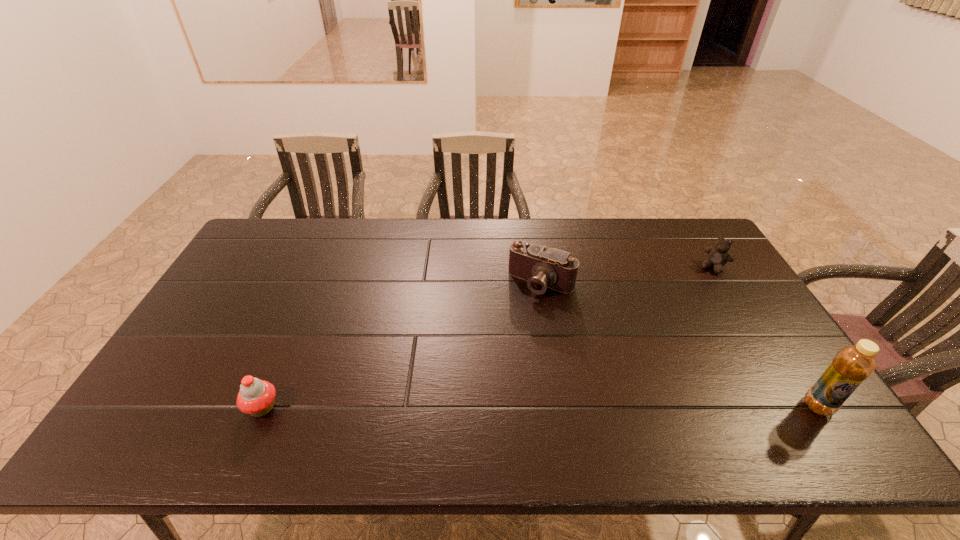
At what (x,y) coordinates should I click in order to perform the action: click on vacant space on the desktop that is between the leftmost object and the bottle and is positioned on the face of the teddy bear. Please return your answer as a coordinate pair (x, y). The image size is (960, 540). Looking at the image, I should click on (617, 407).

At what (x,y) coordinates should I click in order to perform the action: click on free space on the desktop that is between the cupcake and the bottle and is positioned on the front-facing side of the third object from right to left. Please return your answer as a coordinate pair (x, y). Looking at the image, I should click on (461, 407).